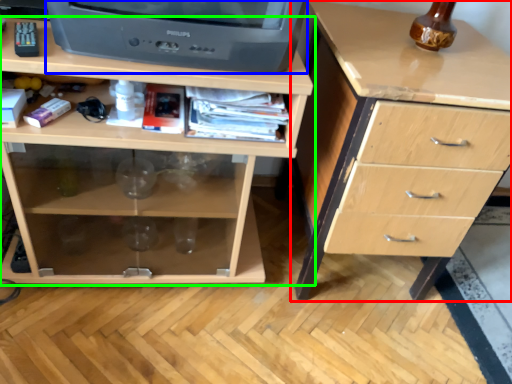
Question: Estimate the real-world distances between objects in this image. Which object is farther from chest of drawers (highlighted by a red box), television (highlighted by a blue box) or chest of drawers (highlighted by a green box)?

Choices:
 (A) television
 (B) chest of drawers

Answer: (A)